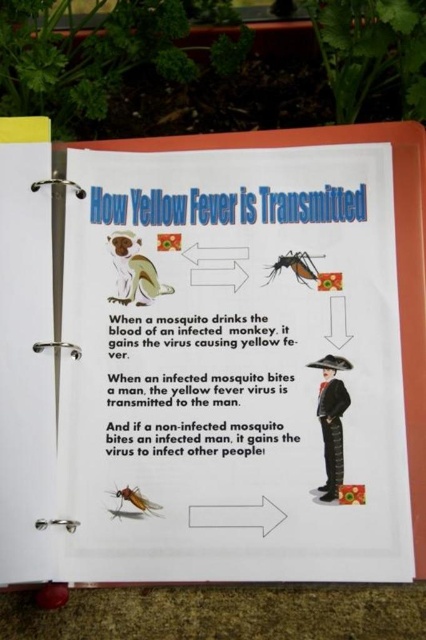
Question: Observing the image, what is the correct spatial positioning of translucent white mosquito at center in reference to translucent brown mosquito at center?

Choices:
 (A) right
 (B) left

Answer: (A)

Question: Which of these objects is positioned closest to the brown fur monkey at upper left?

Choices:
 (A) translucent brown mosquito at center
 (B) translucent white mosquito at center
 (C) white paper at center

Answer: (B)

Question: Which of the following is the closest to the observer?

Choices:
 (A) white paper at center
 (B) translucent brown mosquito at center

Answer: (A)

Question: Considering the relative positions of white paper at center and translucent brown mosquito at center in the image provided, where is white paper at center located with respect to translucent brown mosquito at center?

Choices:
 (A) above
 (B) below

Answer: (A)

Question: Among these points, which one is farthest from the camera?

Choices:
 (A) (175, 154)
 (B) (313, 275)
 (C) (126, 298)
 (D) (127, 492)

Answer: (A)

Question: Is translucent white mosquito at center to the right of translucent brown mosquito at center from the viewer's perspective?

Choices:
 (A) no
 (B) yes

Answer: (B)